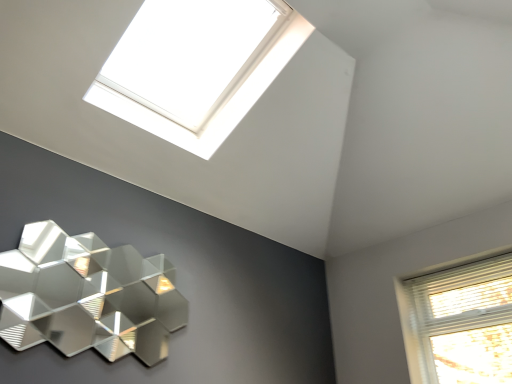
Question: From the image's perspective, is metallic hexagonal lamp at lower left over white plastic window at upper center?

Choices:
 (A) yes
 (B) no

Answer: (B)

Question: Considering the relative sizes of metallic hexagonal lamp at lower left and white plastic window at upper center in the image provided, is metallic hexagonal lamp at lower left thinner than white plastic window at upper center?

Choices:
 (A) no
 (B) yes

Answer: (B)

Question: Is metallic hexagonal lamp at lower left positioned behind white plastic window at upper center?

Choices:
 (A) no
 (B) yes

Answer: (A)

Question: Is metallic hexagonal lamp at lower left to the right of white plastic window at upper center from the viewer's perspective?

Choices:
 (A) no
 (B) yes

Answer: (A)

Question: From a real-world perspective, is metallic hexagonal lamp at lower left on top of white plastic window at upper center?

Choices:
 (A) no
 (B) yes

Answer: (A)

Question: Is metallic hexagonal lamp at lower left not within white plastic window at upper center?

Choices:
 (A) yes
 (B) no

Answer: (A)

Question: Considering the relative sizes of white plastic window at upper center and metallic hexagonal lamp at lower left in the image provided, is white plastic window at upper center bigger than metallic hexagonal lamp at lower left?

Choices:
 (A) yes
 (B) no

Answer: (A)

Question: Would you consider white plastic window at upper center to be distant from metallic hexagonal lamp at lower left?

Choices:
 (A) no
 (B) yes

Answer: (B)

Question: Does white plastic window at upper center have a smaller size compared to metallic hexagonal lamp at lower left?

Choices:
 (A) yes
 (B) no

Answer: (B)

Question: Is metallic hexagonal lamp at lower left at the back of white plastic window at upper center?

Choices:
 (A) yes
 (B) no

Answer: (B)

Question: Considering the relative sizes of white plastic window at upper center and metallic hexagonal lamp at lower left in the image provided, is white plastic window at upper center wider than metallic hexagonal lamp at lower left?

Choices:
 (A) no
 (B) yes

Answer: (B)

Question: Is white plastic window at upper center behind metallic hexagonal lamp at lower left?

Choices:
 (A) no
 (B) yes

Answer: (B)

Question: From a real-world perspective, relative to white plastic window at upper center, is metallic hexagonal lamp at lower left vertically above or below?

Choices:
 (A) below
 (B) above

Answer: (A)